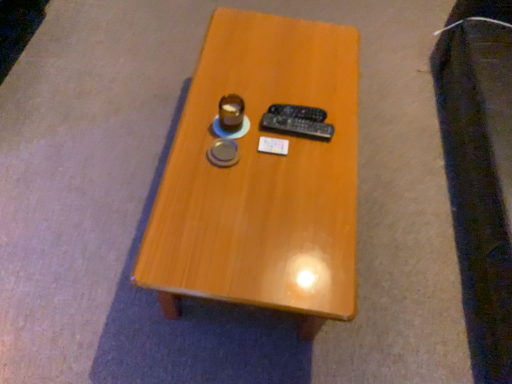
Image resolution: width=512 pixels, height=384 pixels. I want to click on vacant space to the right of wooden table at center, so click(404, 218).